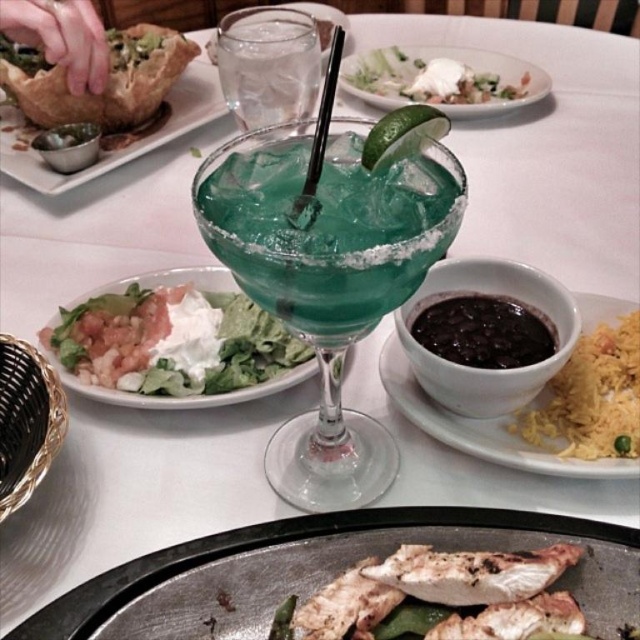
Question: Can you confirm if charcoal grill plate at center is positioned above white creamy sauce at center?

Choices:
 (A) no
 (B) yes

Answer: (A)

Question: Is the position of teal glass margarita at center more distant than that of charcoal grill plate at center?

Choices:
 (A) no
 (B) yes

Answer: (A)

Question: Does green leafy salad at left appear under black matte beans at center?

Choices:
 (A) no
 (B) yes

Answer: (B)

Question: Which point is farther to the camera?

Choices:
 (A) (220, 28)
 (B) (420, 518)
 (C) (497, 349)

Answer: (A)

Question: Which point appears closest to the camera in this image?

Choices:
 (A) (422, 630)
 (B) (525, 465)
 (C) (118, 307)
 (D) (516, 364)

Answer: (A)

Question: Which of the following is the closest to the observer?

Choices:
 (A) (410, 394)
 (B) (477, 358)

Answer: (B)